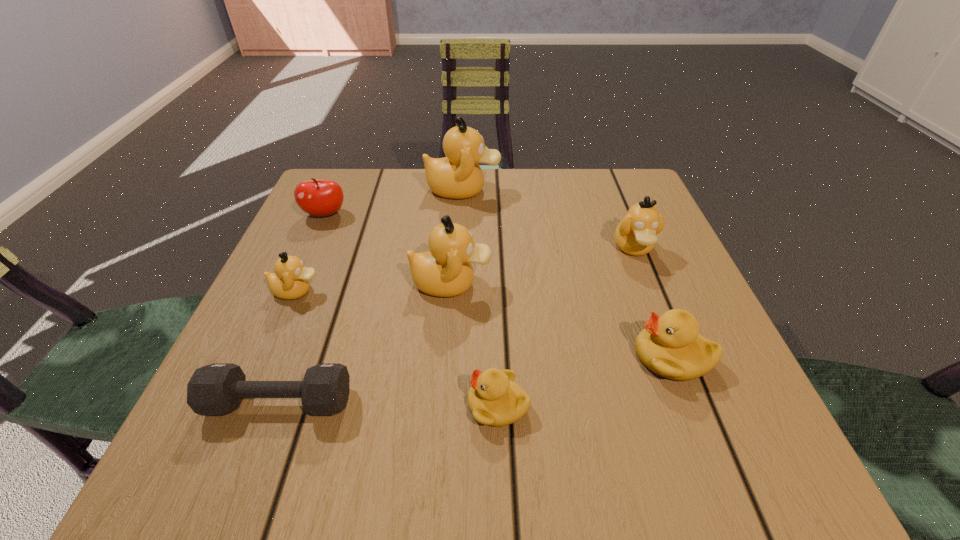
Identify the location of the shortest duckling. Image resolution: width=960 pixels, height=540 pixels. (494, 399).

Identify the location of the smaller yellow duckling. This screenshot has width=960, height=540. (494, 399).

You are a GUI agent. You are given a task and a screenshot of the screen. Output one action in this format:
    pyautogui.click(x=<x>, y=<y>)
    Task: Click on the dumbbell
    The image size is (960, 540).
    Given the screenshot: What is the action you would take?
    pyautogui.click(x=214, y=390)

I want to click on vacant space situated 0.050m on the face of the biggest tan duckling, so click(521, 190).

The width and height of the screenshot is (960, 540). Identify the location of free space located on the face of the second biggest tan duckling. (534, 283).

The height and width of the screenshot is (540, 960). Find the location of `vacant space situated 0.260m on the face of the sixth shortest object`. vacant space situated 0.260m on the face of the sixth shortest object is located at coordinates (687, 382).

This screenshot has width=960, height=540. Find the location of `vacant space located 0.140m on the front of the apple`. vacant space located 0.140m on the front of the apple is located at coordinates (301, 268).

The image size is (960, 540). I want to click on vacant space situated 0.230m on the front-facing side of the right yellow duckling, so click(490, 356).

Where is `vacant point located 0.270m on the front-facing side of the right yellow duckling`? The width and height of the screenshot is (960, 540). vacant point located 0.270m on the front-facing side of the right yellow duckling is located at coordinates [x=464, y=356].

Locate an element on the screen. The width and height of the screenshot is (960, 540). blank space located on the front-facing side of the right yellow duckling is located at coordinates (414, 356).